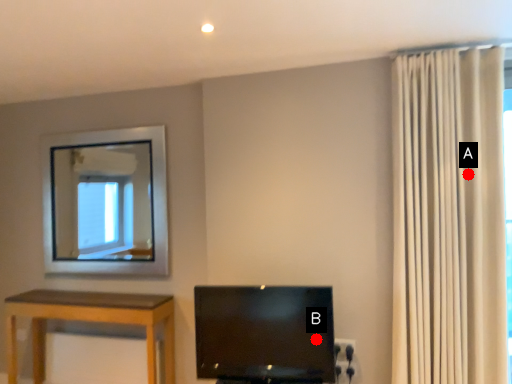
Question: Two points are circled on the image, labeled by A and B beside each circle. Which of the following is the farthest from the observer?

Choices:
 (A) A is further
 (B) B is further

Answer: (A)